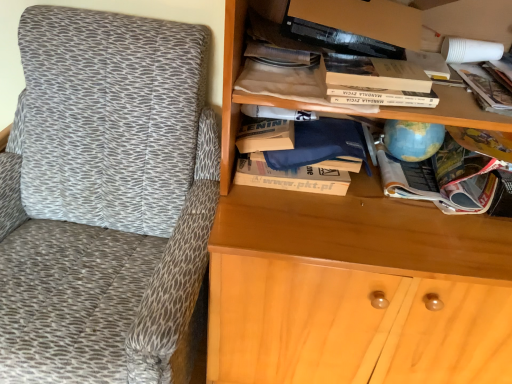
What do you see at coordinates (308, 159) in the screenshot? This screenshot has height=384, width=512. I see `white cardboard book at center, the 2th book in the right-to-left sequence` at bounding box center [308, 159].

What do you see at coordinates (239, 70) in the screenshot?
I see `wooden bookshelf at upper right` at bounding box center [239, 70].

What do you see at coordinates (375, 73) in the screenshot? I see `hardcover book at upper center` at bounding box center [375, 73].

What are the coordinates of `white cardboard book at center, the 2th book in the right-to-left sequence` in the screenshot? It's located at [308, 159].

Find the location of a particular element. The image size is (512, 384). the 3rd book behind the textured fabric chair at left, starting your count from the anchor is located at coordinates (446, 179).

Based on the photo, which object is closer to the camera, multicolored paper magazine at center right, which is counted as the third book, starting from the left, or textured fabric chair at left?

textured fabric chair at left.

Which of these two, multicolored paper magazine at center right, which appears as the 1th book when viewed from the right, or textured fabric chair at left, is smaller?

multicolored paper magazine at center right, which appears as the 1th book when viewed from the right.

Considering their positions, is textured fabric chair at left located in front of or behind white cardboard book at center, the 2th book in the right-to-left sequence?

textured fabric chair at left is in front of white cardboard book at center, the 2th book in the right-to-left sequence.

Measure the distance between textured fabric chair at left and white cardboard book at center, the 2th book in the right-to-left sequence.

16.38 inches.

Considering the relative sizes of textured fabric chair at left and white cardboard book at center, which appears as the second book when viewed from the left, in the image provided, is textured fabric chair at left wider than white cardboard book at center, which appears as the second book when viewed from the left,?

Yes.

From the picture: In terms of width, does hardcover book at upper center look wider or thinner when compared to wooden bookshelf at upper right?

Clearly, hardcover book at upper center has less width compared to wooden bookshelf at upper right.

How far apart are hardcover book at upper center and wooden bookshelf at upper right?

hardcover book at upper center and wooden bookshelf at upper right are 4.61 inches apart.

Which point is more distant from viewer, (418, 90) or (224, 59)?

The point (418, 90) is farther.

From the image's perspective, which one is positioned higher, hardcover book at upper center or wooden bookshelf at upper right?

From the image's view, wooden bookshelf at upper right is above.

Which is correct: white paper bag at upper center, which appears as the 3th book when viewed from the right, is inside white cardboard book at center, the 2th book in the right-to-left sequence, or outside of it?

white paper bag at upper center, which appears as the 3th book when viewed from the right, exists outside the volume of white cardboard book at center, the 2th book in the right-to-left sequence.

Between white paper bag at upper center, which appears as the 3th book when viewed from the right, and white cardboard book at center, which appears as the second book when viewed from the left, which one has larger size?

With larger size is white cardboard book at center, which appears as the second book when viewed from the left.

Is point (281, 66) positioned after point (292, 154)?

No, it is not.

Is white paper bag at upper center, the first book when ordered from left to right, further to the viewer compared to white cardboard book at center, the 2th book in the right-to-left sequence?

No, white paper bag at upper center, the first book when ordered from left to right, is in front of white cardboard book at center, the 2th book in the right-to-left sequence.

What's the angular difference between white paper bag at upper center, the first book when ordered from left to right, and textured fabric chair at left's facing directions?

There is a 7-degree angle between the facing directions of white paper bag at upper center, the first book when ordered from left to right, and textured fabric chair at left.

Is white paper bag at upper center, the first book when ordered from left to right, inside or outside of textured fabric chair at left?

white paper bag at upper center, the first book when ordered from left to right, cannot be found inside textured fabric chair at left.

In the image, is white paper bag at upper center, which appears as the 3th book when viewed from the right, positioned in front of or behind textured fabric chair at left?

In the image, white paper bag at upper center, which appears as the 3th book when viewed from the right, appears behind textured fabric chair at left.

Considering the relative sizes of white paper bag at upper center, which appears as the 3th book when viewed from the right, and textured fabric chair at left in the image provided, is white paper bag at upper center, which appears as the 3th book when viewed from the right, shorter than textured fabric chair at left?

Correct, white paper bag at upper center, which appears as the 3th book when viewed from the right, is not as tall as textured fabric chair at left.

In the scene shown: Does wooden bookshelf at upper right have a lesser width compared to white cardboard book at center, the 2th book in the right-to-left sequence?

Indeed, wooden bookshelf at upper right has a lesser width compared to white cardboard book at center, the 2th book in the right-to-left sequence.

In the scene shown: Does wooden bookshelf at upper right have a larger size compared to white cardboard book at center, the 2th book in the right-to-left sequence?

Yes, wooden bookshelf at upper right is bigger than white cardboard book at center, the 2th book in the right-to-left sequence.

Considering the relative positions of wooden bookshelf at upper right and white cardboard book at center, the 2th book in the right-to-left sequence, in the image provided, is wooden bookshelf at upper right to the left or to the right of white cardboard book at center, the 2th book in the right-to-left sequence,?

wooden bookshelf at upper right is to the right of white cardboard book at center, the 2th book in the right-to-left sequence.

Does wooden bookshelf at upper right turn towards white cardboard book at center, which appears as the second book when viewed from the left?

No, wooden bookshelf at upper right does not turn towards white cardboard book at center, which appears as the second book when viewed from the left.

Can you confirm if white paper bag at upper center, which appears as the 3th book when viewed from the right, is thinner than wooden bookshelf at upper right?

Yes.

How much distance is there between white paper bag at upper center, which appears as the 3th book when viewed from the right, and wooden bookshelf at upper right?

white paper bag at upper center, which appears as the 3th book when viewed from the right, and wooden bookshelf at upper right are 4.28 inches apart from each other.

Is white paper bag at upper center, the first book when ordered from left to right, taller or shorter than wooden bookshelf at upper right?

white paper bag at upper center, the first book when ordered from left to right, is shorter than wooden bookshelf at upper right.

Is white paper bag at upper center, which appears as the 3th book when viewed from the right, to the right of wooden bookshelf at upper right from the viewer's perspective?

No.

Locate an element on the screen. This screenshot has height=384, width=512. chair on the left of multicolored paper magazine at center right, which appears as the 1th book when viewed from the right is located at coordinates (106, 200).

Find the location of a particular element. The image size is (512, 384). chair directly beneath the white cardboard book at center, which appears as the second book when viewed from the left (from a real-world perspective) is located at coordinates (106, 200).

Considering their positions, is white cardboard book at center, the 2th book in the right-to-left sequence, positioned closer to textured fabric chair at left than white paper bag at upper center, which appears as the 3th book when viewed from the right?

Based on the image, white cardboard book at center, the 2th book in the right-to-left sequence, appears to be nearer to textured fabric chair at left.

Estimate the real-world distances between objects in this image. Which object is further from hardcover book at upper center, white cardboard book at center, which appears as the second book when viewed from the left, or multicolored paper magazine at center right, which is counted as the third book, starting from the left?

Based on the image, multicolored paper magazine at center right, which is counted as the third book, starting from the left, appears to be further to hardcover book at upper center.

From the image, which object appears to be farther from multicolored paper magazine at center right, which appears as the 1th book when viewed from the right, wooden bookshelf at upper right or white cardboard book at center, which appears as the second book when viewed from the left?

wooden bookshelf at upper right is further to multicolored paper magazine at center right, which appears as the 1th book when viewed from the right.

When comparing their distances from wooden bookshelf at upper right, does hardcover book at upper center or white paper bag at upper center, the first book when ordered from left to right, seem closer?

Among the two, white paper bag at upper center, the first book when ordered from left to right, is located nearer to wooden bookshelf at upper right.

Estimate the real-world distances between objects in this image. Which object is closer to hardcover book at upper center, white cardboard book at center, the 2th book in the right-to-left sequence, or textured fabric chair at left?

white cardboard book at center, the 2th book in the right-to-left sequence, is positioned closer to the anchor hardcover book at upper center.

From the picture: Which object lies nearer to the anchor point white cardboard book at center, the 2th book in the right-to-left sequence, multicolored paper magazine at center right, which is counted as the third book, starting from the left, or white paper bag at upper center, which appears as the 3th book when viewed from the right?

Based on the image, multicolored paper magazine at center right, which is counted as the third book, starting from the left, appears to be nearer to white cardboard book at center, the 2th book in the right-to-left sequence.

Considering their positions, is multicolored paper magazine at center right, which appears as the 1th book when viewed from the right, positioned further to hardcover book at upper center than white paper bag at upper center, the first book when ordered from left to right?

Based on the image, multicolored paper magazine at center right, which appears as the 1th book when viewed from the right, appears to be further to hardcover book at upper center.

Estimate the real-world distances between objects in this image. Which object is further from white paper bag at upper center, which appears as the 3th book when viewed from the right, multicolored paper magazine at center right, which is counted as the third book, starting from the left, or hardcover book at upper center?

multicolored paper magazine at center right, which is counted as the third book, starting from the left, lies further to white paper bag at upper center, which appears as the 3th book when viewed from the right, than the other object.

Where is `paperback book between textured fabric chair at left and multicolored paper magazine at center right, which is counted as the third book, starting from the left`? Image resolution: width=512 pixels, height=384 pixels. paperback book between textured fabric chair at left and multicolored paper magazine at center right, which is counted as the third book, starting from the left is located at coordinates (375, 73).

You are a GUI agent. You are given a task and a screenshot of the screen. Output one action in this format:
    pyautogui.click(x=<x>, y=<y>)
    Task: Click on the book between white paper bag at upper center, the first book when ordered from left to right, and hardcover book at upper center, in the horizontal direction
    The height and width of the screenshot is (384, 512).
    Given the screenshot: What is the action you would take?
    pyautogui.click(x=308, y=159)

Identify the location of book between textured fabric chair at left and white cardboard book at center, which appears as the second book when viewed from the left, in the horizontal direction. (283, 80).

Identify the location of shelf located between textured fabric chair at left and multicolored paper magazine at center right, which appears as the 1th book when viewed from the right, in the left-right direction. (239, 70).